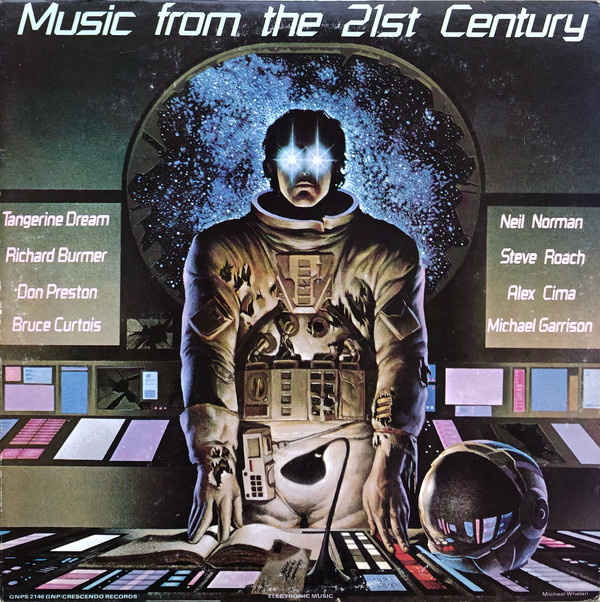
Find the location of a particular element. lamp is located at coordinates (299, 468).